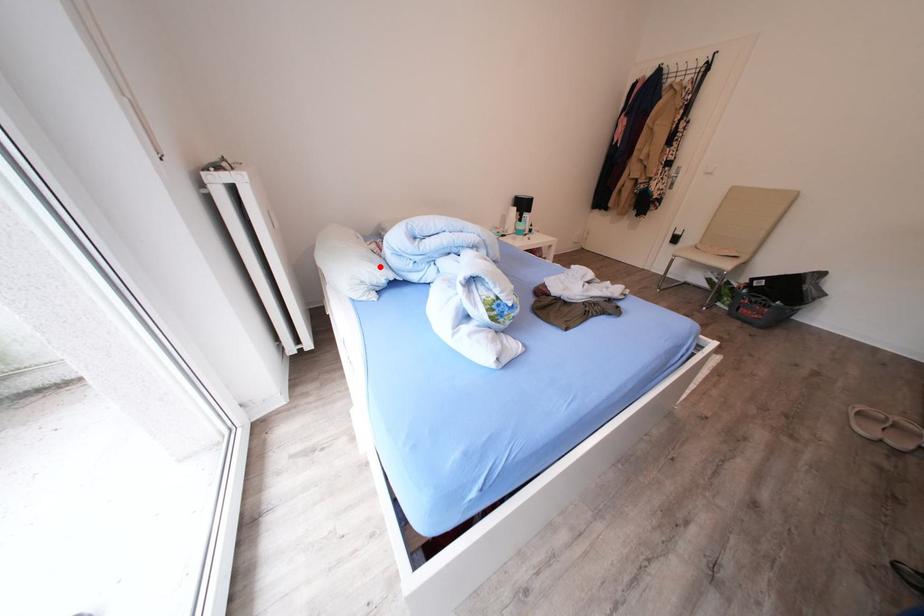
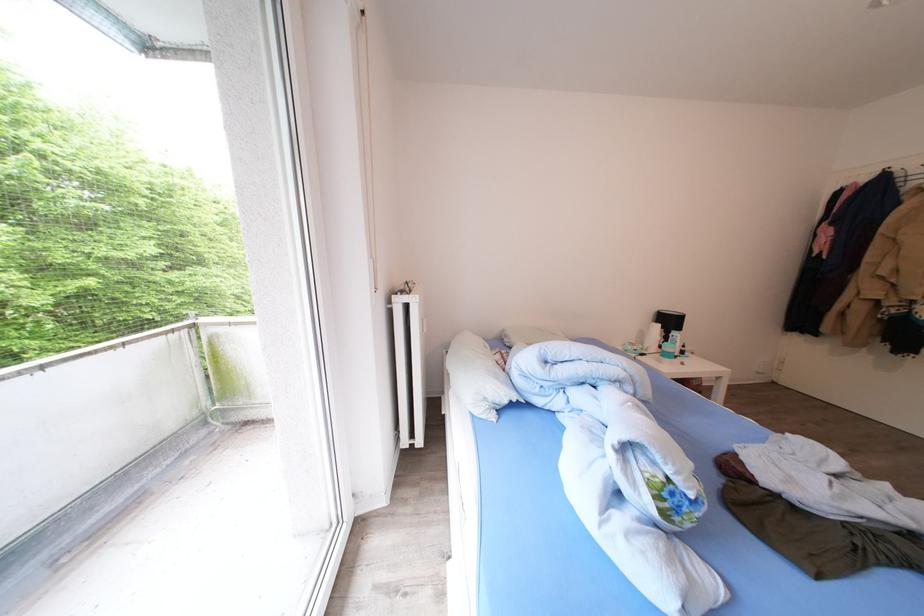
The point at the highlighted location is marked in the first image. Where is the corresponding point in the second image?

(505, 383)